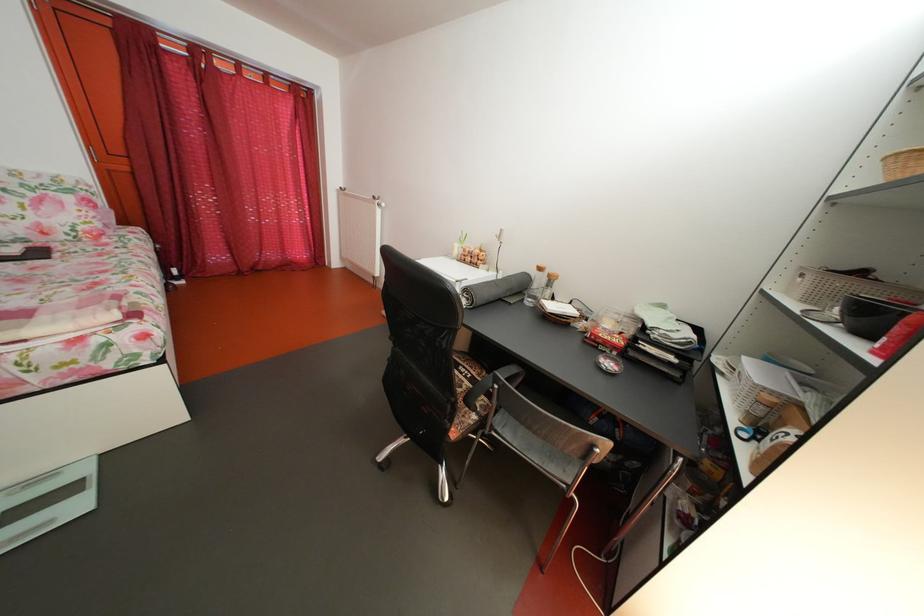
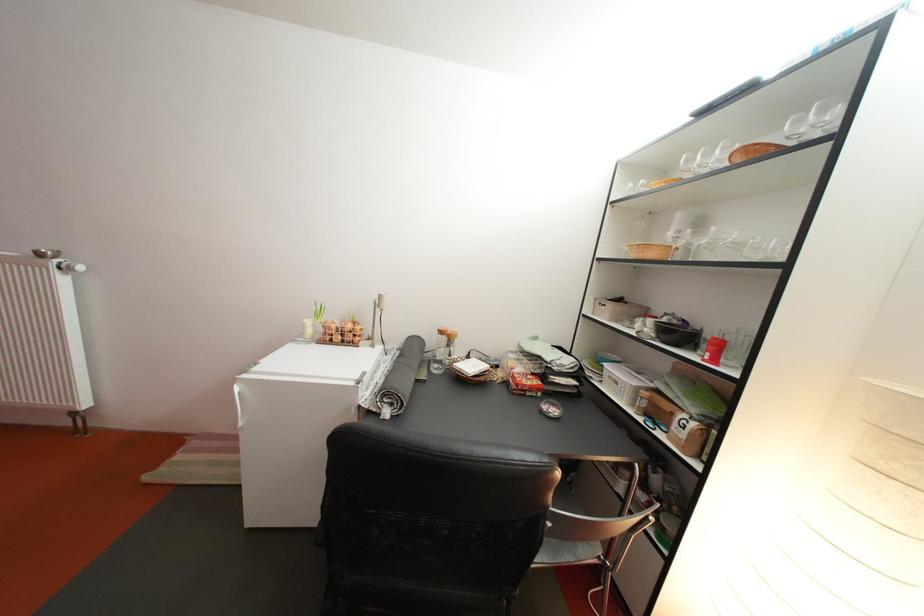
In the second image, find the point that corresponds to (x=551, y=286) in the first image.

(444, 346)